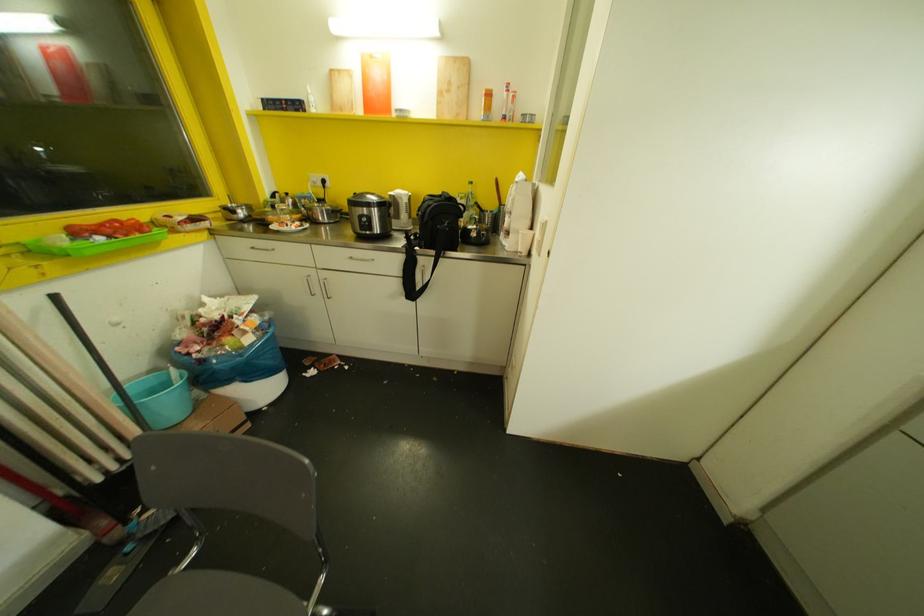
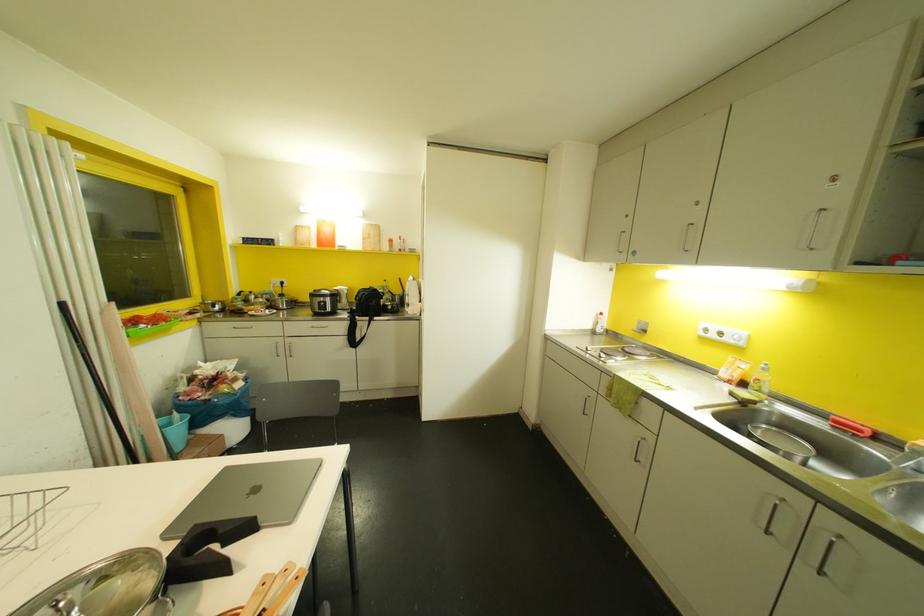
Question: What movement of the cameraman would produce the second image?

Choices:
 (A) Left
 (B) Right
 (C) Forward
 (D) Backward

Answer: (D)